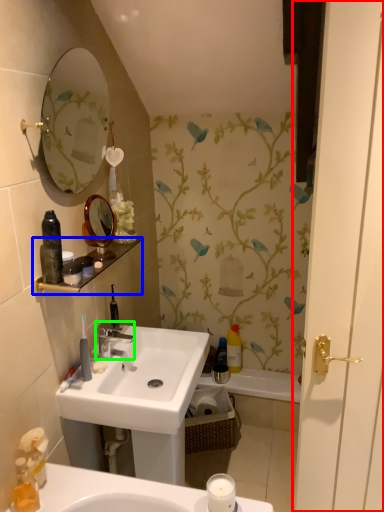
Question: Considering the real-world distances, which object is closest to screen door (highlighted by a red box)? balustrade (highlighted by a blue box) or tap (highlighted by a green box).

Choices:
 (A) balustrade
 (B) tap

Answer: (A)